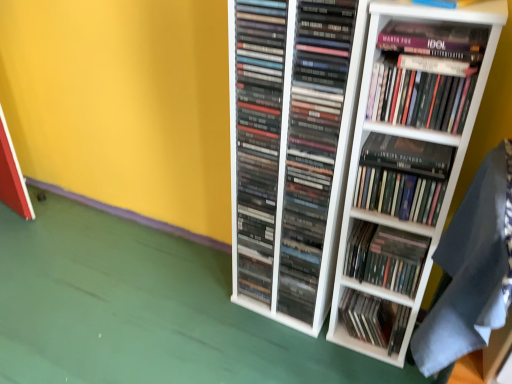
The height and width of the screenshot is (384, 512). In order to click on free space in front of matte black book at center, which appears as the 7th book when viewed from the top in this screenshot , I will do `click(366, 362)`.